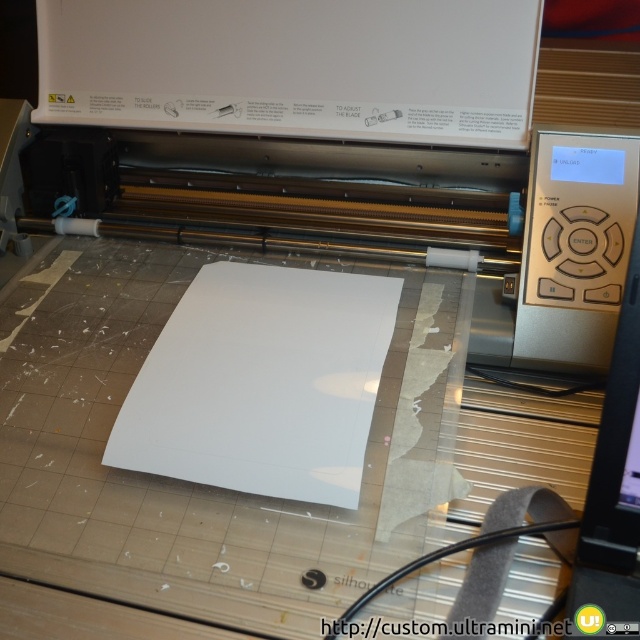
Question: Which object appears closest to the camera in this image?

Choices:
 (A) white matte paper at center
 (B) metallic silver printer at center

Answer: (A)

Question: In this image, where is metallic silver printer at center located relative to white matte paper at center?

Choices:
 (A) right
 (B) left

Answer: (B)

Question: In this image, where is metallic silver printer at center located relative to white matte paper at center?

Choices:
 (A) above
 (B) below

Answer: (A)

Question: Can you confirm if metallic silver printer at center is positioned above white matte paper at center?

Choices:
 (A) no
 (B) yes

Answer: (B)